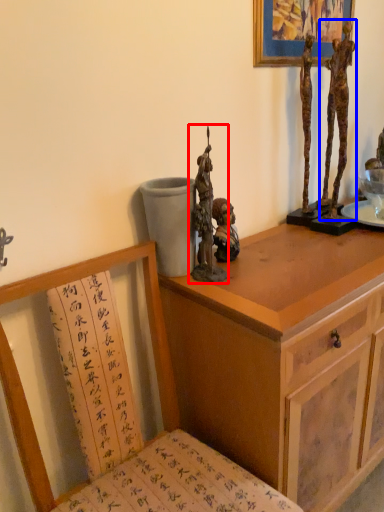
Question: Which point is further to the camera, sculpture (highlighted by a red box) or person (highlighted by a blue box)?

Choices:
 (A) sculpture
 (B) person

Answer: (B)